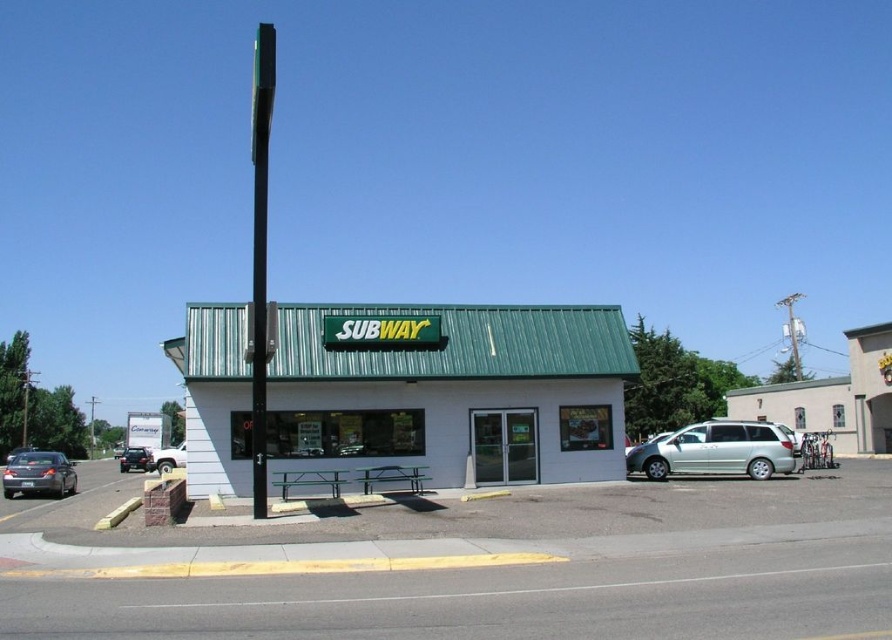
You are a customer trying to park your car in the parking lot in front of the Subway shop. You see a white matte truck at lower left and a shiny black sedan at left. Which vehicle takes up less space horizontally in the parking spot?

The white matte truck at lower left is thinner than the shiny black sedan at left, so the white matte truck at lower left takes up less space horizontally in the parking spot.

You are a customer arriving at the Subway shop and want to park your car. You see a white matte truck at lower left and a shiny black sedan at left. Which vehicle is blocking the parking spot closer to the entrance?

The white matte truck at lower left is blocking the parking spot closer to the entrance because it is in front of the shiny black sedan at left, meaning it is closer to the entrance.

You are a customer arriving at the Subway shop and see the silver metallic minivan at lower right and the white matte truck at lower left. Which vehicle is parked closer to the entrance of the Subway shop?

The silver metallic minivan at lower right is to the right of the white matte truck at lower left, so the white matte truck at lower left is closer to the entrance since it is positioned to the left side near the entrance.